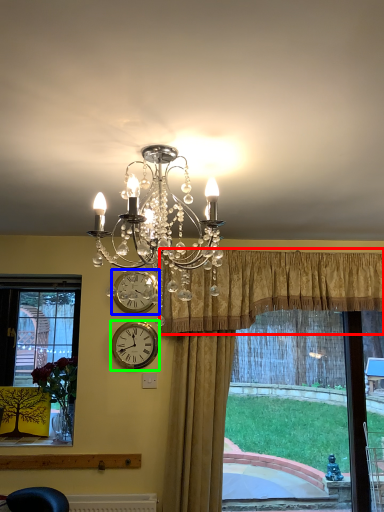
Question: Which is farther away from curtain (highlighted by a red box)? clock (highlighted by a blue box) or wall clock (highlighted by a green box)?

Choices:
 (A) clock
 (B) wall clock

Answer: (B)